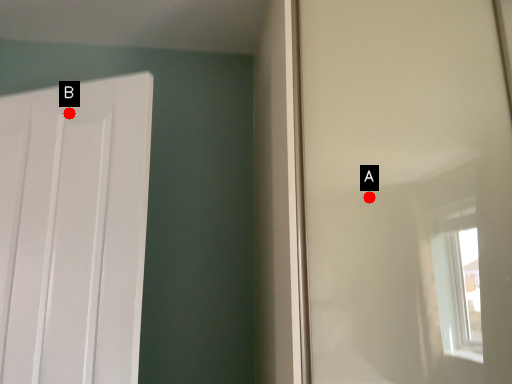
Question: Two points are circled on the image, labeled by A and B beside each circle. Which point is farther from the camera taking this photo?

Choices:
 (A) A is further
 (B) B is further

Answer: (B)